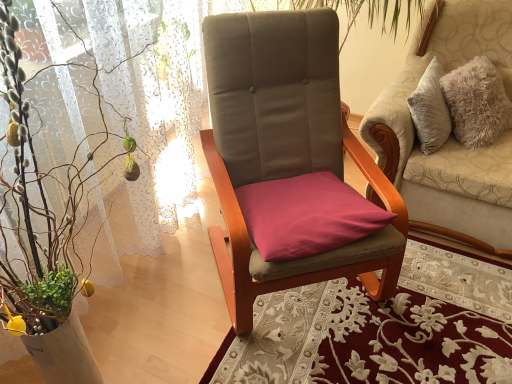
Locate an element on the screen. vacant location below green leafy plant at left (from a real-world perspective) is located at coordinates (144, 339).